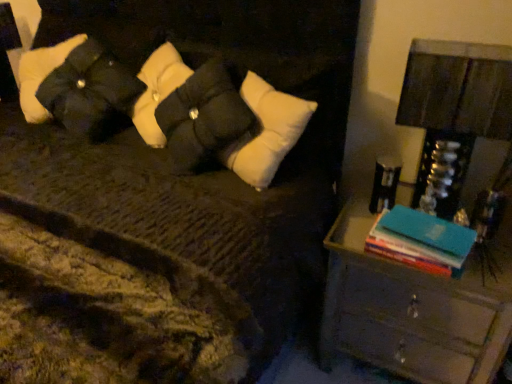
I want to click on metallic silver lampshade at right, so click(456, 97).

Locate an element on the screen. The width and height of the screenshot is (512, 384). blue hardcover book at right is located at coordinates pyautogui.click(x=421, y=241).

The width and height of the screenshot is (512, 384). In order to click on nightstand behind the metallic silver lampshade at right in this screenshot , I will do `click(423, 264)`.

Between wooden nightstand at right and metallic silver lampshade at right, which one is positioned in front?

metallic silver lampshade at right is more forward.

Is wooden nightstand at right at the left side of metallic silver lampshade at right?

Correct, you'll find wooden nightstand at right to the left of metallic silver lampshade at right.

Would you say metallic silver lampshade at right is part of wooden nightstand at right's contents?

No, metallic silver lampshade at right is not a part of wooden nightstand at right.

From a real-world perspective, who is located higher, blue hardcover book at right or black quilted pillow at upper left?

In real-world perspective, black quilted pillow at upper left is above.

From the picture: Could you tell me if blue hardcover book at right is turned towards black quilted pillow at upper left?

No, blue hardcover book at right is not turned towards black quilted pillow at upper left.

Is point (373, 227) closer to viewer compared to point (103, 107)?

No, it is not.

Can you tell me how much blue hardcover book at right and wooden nightstand at right differ in facing direction?

5.1 degrees.

Considering the points (382, 239) and (329, 331), which point is behind, point (382, 239) or point (329, 331)?

The point (329, 331) is more distant.

Would you say blue hardcover book at right is a long distance from wooden nightstand at right?

They are positioned close to each other.

In terms of height, does blue hardcover book at right look taller or shorter compared to wooden nightstand at right?

In the image, blue hardcover book at right appears to be shorter than wooden nightstand at right.

At what (x,y) coordinates should I click in order to perform the action: click on nightstand below the blue hardcover book at right (from a real-world perspective). Please return your answer as a coordinate pair (x, y). This screenshot has height=384, width=512. Looking at the image, I should click on (423, 264).

From the image's perspective, relative to blue hardcover book at right, is wooden nightstand at right above or below?

wooden nightstand at right is situated lower than blue hardcover book at right in the image.

Who is taller, wooden nightstand at right or blue hardcover book at right?

Standing taller between the two is wooden nightstand at right.

From a real-world perspective, is metallic silver lampshade at right above or below black quilted pillow at upper left?

metallic silver lampshade at right is below black quilted pillow at upper left.

In the scene shown: Would you consider metallic silver lampshade at right to be distant from black quilted pillow at upper left?

Yes, metallic silver lampshade at right is far from black quilted pillow at upper left.

Is black quilted pillow at upper left a part of metallic silver lampshade at right?

No, black quilted pillow at upper left is not inside metallic silver lampshade at right.

From the image's perspective, would you say metallic silver lampshade at right is positioned over black quilted pillow at upper left?

No, from the image's perspective, metallic silver lampshade at right is not on top of black quilted pillow at upper left.

Between point (35, 120) and point (415, 68), which one is positioned in front?

Positioned in front is point (415, 68).

Is black quilted pillow at upper left looking in the opposite direction of metallic silver lampshade at right?

No, metallic silver lampshade at right is not at the back of black quilted pillow at upper left.

Find the location of `bedside lamp that is in front of the black quilted pillow at upper left`. bedside lamp that is in front of the black quilted pillow at upper left is located at coordinates (456, 97).

Based on the photo, between black quilted pillow at upper left and metallic silver lampshade at right, which one is positioned in front?

Positioned in front is metallic silver lampshade at right.

Between black quilted pillow at upper left and wooden nightstand at right, which one has larger width?

wooden nightstand at right.

From the picture: Could you tell me if black quilted pillow at upper left is facing wooden nightstand at right?

No, black quilted pillow at upper left is not oriented towards wooden nightstand at right.

Based on their positions, is black quilted pillow at upper left located to the left or right of wooden nightstand at right?

From the image, it's evident that black quilted pillow at upper left is to the left of wooden nightstand at right.

From a real-world perspective, is black quilted pillow at upper left physically located above or below wooden nightstand at right?

black quilted pillow at upper left is above wooden nightstand at right.

Find the location of a particular element. Image resolution: width=512 pixels, height=384 pixels. bedside lamp located above the wooden nightstand at right (from a real-world perspective) is located at coordinates (456, 97).

Image resolution: width=512 pixels, height=384 pixels. I want to click on pillow on the left of blue hardcover book at right, so click(x=77, y=87).

Based on their spatial positions, is metallic silver lampshade at right or blue hardcover book at right further from black quilted pillow at upper left?

blue hardcover book at right is positioned further to the anchor black quilted pillow at upper left.

Which object lies nearer to the anchor point wooden nightstand at right, blue hardcover book at right or black quilted pillow at upper left?

Based on the image, blue hardcover book at right appears to be nearer to wooden nightstand at right.

From the image, which object appears to be farther from wooden nightstand at right, black quilted pillow at upper left or blue hardcover book at right?

black quilted pillow at upper left lies further to wooden nightstand at right than the other object.

Considering their positions, is blue hardcover book at right positioned further to wooden nightstand at right than metallic silver lampshade at right?

blue hardcover book at right lies further to wooden nightstand at right than the other object.

Based on their spatial positions, is black quilted pillow at upper left or metallic silver lampshade at right closer to wooden nightstand at right?

metallic silver lampshade at right is positioned closer to the anchor wooden nightstand at right.

Considering their positions, is blue hardcover book at right positioned further to metallic silver lampshade at right than black quilted pillow at upper left?

black quilted pillow at upper left is positioned further to the anchor metallic silver lampshade at right.

Considering their positions, is wooden nightstand at right positioned closer to black quilted pillow at upper left than metallic silver lampshade at right?

metallic silver lampshade at right is positioned closer to the anchor black quilted pillow at upper left.

From the image, which object appears to be farther from blue hardcover book at right, metallic silver lampshade at right or black quilted pillow at upper left?

black quilted pillow at upper left.

Where is `book between black quilted pillow at upper left and metallic silver lampshade at right from left to right`? The height and width of the screenshot is (384, 512). book between black quilted pillow at upper left and metallic silver lampshade at right from left to right is located at coordinates (421, 241).

This screenshot has width=512, height=384. I want to click on nightstand situated between black quilted pillow at upper left and metallic silver lampshade at right from left to right, so click(423, 264).

The width and height of the screenshot is (512, 384). What are the coordinates of `book between metallic silver lampshade at right and wooden nightstand at right in the vertical direction` in the screenshot? It's located at [421, 241].

The image size is (512, 384). Find the location of `book situated between black quilted pillow at upper left and wooden nightstand at right from left to right`. book situated between black quilted pillow at upper left and wooden nightstand at right from left to right is located at coordinates (421, 241).